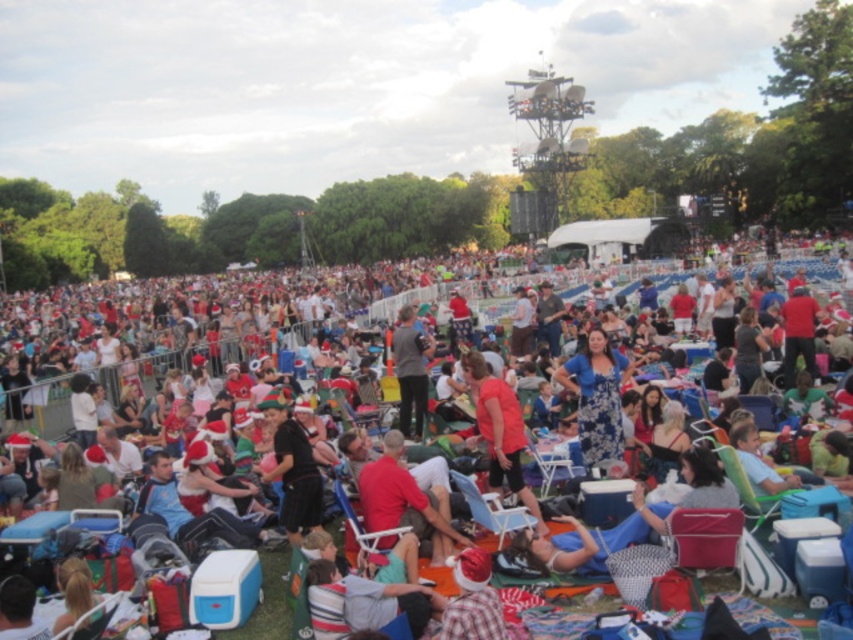
Question: Which of the following is the farthest from the observer?

Choices:
 (A) (471, 513)
 (B) (12, 413)
 (C) (601, 388)
 (D) (451, 534)

Answer: (B)

Question: Which point is closer to the camera?

Choices:
 (A) (486, 515)
 (B) (506, 461)
 (C) (392, 360)

Answer: (A)

Question: Can you confirm if black matte shirt at center is wider than dark gray fabric jacket at center?

Choices:
 (A) no
 (B) yes

Answer: (B)

Question: Is floral fabric dress at center wider than red matte shirt at center?

Choices:
 (A) yes
 (B) no

Answer: (A)

Question: Is black matte shirt at center thinner than blue plastic chair at center?

Choices:
 (A) yes
 (B) no

Answer: (B)

Question: Which of the following is the closest to the observer?

Choices:
 (A) (555, 372)
 (B) (363, 467)
 (C) (589, 545)
 (D) (509, 467)

Answer: (C)